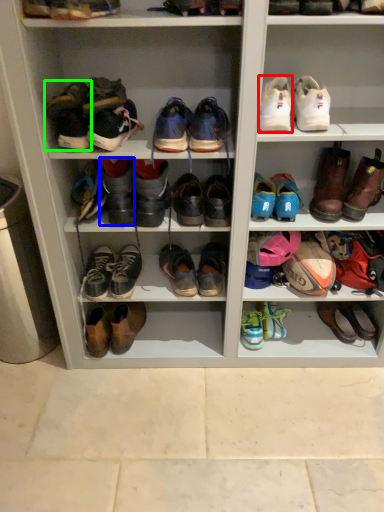
Question: Considering the real-world distances, which object is farthest from shoe (highlighted by a red box)? footwear (highlighted by a blue box) or shoe (highlighted by a green box)?

Choices:
 (A) footwear
 (B) shoe

Answer: (B)